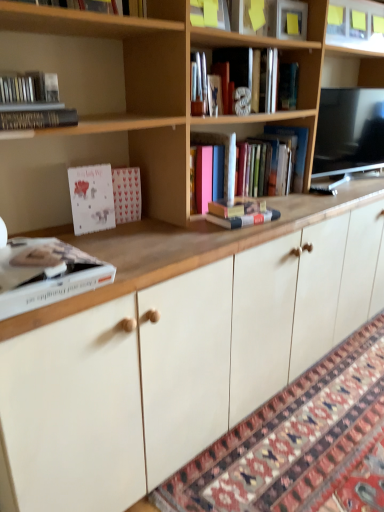
What is the approximate width of matte black bookshelf at upper left, the seventh book positioned from the right?

4.85 inches.

Image resolution: width=384 pixels, height=512 pixels. What are the coordinates of `matte black bookshelf at upper left, marked as the first book in a left-to-right arrangement` in the screenshot? It's located at (33, 102).

Identify the location of metallic silver letter at upper center, the second book in the right-to-left sequence. (273, 82).

The height and width of the screenshot is (512, 384). What do you see at coordinates (293, 438) in the screenshot? I see `patterned carpet at lower right` at bounding box center [293, 438].

What do you see at coordinates (225, 156) in the screenshot? This screenshot has width=384, height=512. I see `hardcover book at center, acting as the fourth book starting from the right` at bounding box center [225, 156].

This screenshot has width=384, height=512. What do you see at coordinates (47, 275) in the screenshot?
I see `white matte book at lower left, which is the third book from left to right` at bounding box center [47, 275].

You are a GUI agent. You are given a task and a screenshot of the screen. Output one action in this format:
    pyautogui.click(x=<x>, y=<y>)
    Task: Click on the matte black bookshelf at upper left, marked as the first book in a left-to-right arrangement
    The image size is (384, 512).
    Given the screenshot: What is the action you would take?
    pyautogui.click(x=33, y=102)

Can you confirm if hardcover book at center, which is the 4th book from left to right, is thinner than wooden bookcase at upper center?

Correct, the width of hardcover book at center, which is the 4th book from left to right, is less than that of wooden bookcase at upper center.

In terms of size, does hardcover book at center, which is the 4th book from left to right, appear bigger or smaller than wooden bookcase at upper center?

In the image, hardcover book at center, which is the 4th book from left to right, appears to be smaller than wooden bookcase at upper center.

Measure the distance from hardcover book at center, which is the 4th book from left to right, to wooden bookcase at upper center.

hardcover book at center, which is the 4th book from left to right, is 39.29 centimeters away from wooden bookcase at upper center.

Considering the sizes of hardcover book at center, acting as the fourth book starting from the right, and wooden bookcase at upper center in the image, is hardcover book at center, acting as the fourth book starting from the right, taller or shorter than wooden bookcase at upper center?

Considering their sizes, hardcover book at center, acting as the fourth book starting from the right, has less height than wooden bookcase at upper center.

Is hardcover book at center, acting as the fourth book starting from the right, positioned before patterned carpet at lower right?

No, hardcover book at center, acting as the fourth book starting from the right, is behind patterned carpet at lower right.

Could you tell me if hardcover book at center, acting as the fourth book starting from the right, is turned towards patterned carpet at lower right?

No, hardcover book at center, acting as the fourth book starting from the right, is not turned towards patterned carpet at lower right.

From a real-world perspective, is hardcover book at center, acting as the fourth book starting from the right, above or below patterned carpet at lower right?

Clearly, from a real-world perspective, hardcover book at center, acting as the fourth book starting from the right, is above patterned carpet at lower right.

Identify the location of mat below the hardcover book at center, acting as the fourth book starting from the right (from a real-world perspective). This screenshot has width=384, height=512. (293, 438).

Looking at this image, between hardcover book at center, which is the third book from right to left, and wooden bookcase at upper center, which one has smaller size?

hardcover book at center, which is the third book from right to left, is smaller.

Based on the photo, is hardcover book at center, the 5th book positioned from the left, next to wooden bookcase at upper center and touching it?

No, hardcover book at center, the 5th book positioned from the left, is not beside wooden bookcase at upper center.

Would you say wooden bookcase at upper center is part of hardcover book at center, which is the third book from right to left,'s contents?

No, wooden bookcase at upper center is not surrounded by hardcover book at center, which is the third book from right to left.

From the image's perspective, which one is positioned lower, hardcover book at center, the 5th book positioned from the left, or wooden bookcase at upper center?

hardcover book at center, the 5th book positioned from the left, is shown below in the image.

Can you tell me how much matte black bookshelf at upper left, the seventh book positioned from the right, and white matte book at lower left, which is the third book from left to right, differ in facing direction?

The angle between the facing direction of matte black bookshelf at upper left, the seventh book positioned from the right, and the facing direction of white matte book at lower left, which is the third book from left to right, is 0.00277 degrees.

Can you confirm if matte black bookshelf at upper left, the seventh book positioned from the right, is thinner than white matte book at lower left, which is the third book from left to right?

Correct, the width of matte black bookshelf at upper left, the seventh book positioned from the right, is less than that of white matte book at lower left, which is the third book from left to right.

Considering the positions of objects matte black bookshelf at upper left, the seventh book positioned from the right, and white matte book at lower left, acting as the 5th book starting from the right, in the image provided, who is more to the left, matte black bookshelf at upper left, the seventh book positioned from the right, or white matte book at lower left, acting as the 5th book starting from the right,?

matte black bookshelf at upper left, the seventh book positioned from the right.

Considering the positions of points (233, 190) and (222, 199), is point (233, 190) closer to camera compared to point (222, 199)?

No, it is not.

Is hardcover book at center, which is the 4th book from left to right, bigger or smaller than hardcover book at center, which is the third book from right to left?

Considering their sizes, hardcover book at center, which is the 4th book from left to right, takes up more space than hardcover book at center, which is the third book from right to left.

Considering the sizes of hardcover book at center, acting as the fourth book starting from the right, and hardcover book at center, the 5th book positioned from the left, in the image, is hardcover book at center, acting as the fourth book starting from the right, taller or shorter than hardcover book at center, the 5th book positioned from the left,?

Considering their sizes, hardcover book at center, acting as the fourth book starting from the right, has more height than hardcover book at center, the 5th book positioned from the left.

From the image's perspective, is hardcover book at center, which is the 4th book from left to right, beneath hardcover book at center, which is the third book from right to left?

No.

From a real-world perspective, starting from the hardcover book at center, which is the 7th book in left-to-right order, which book is the 2nd one vertically above it? Please provide its 2D coordinates.

[(33, 102)]

How different are the orientations of hardcover book at center, which is the 7th book in left-to-right order, and matte black bookshelf at upper left, the seventh book positioned from the right, in degrees?

There is a 4.57-degree angle between the facing directions of hardcover book at center, which is the 7th book in left-to-right order, and matte black bookshelf at upper left, the seventh book positioned from the right.

From the picture: Does hardcover book at center, which is the 7th book in left-to-right order, have a smaller size compared to matte black bookshelf at upper left, the seventh book positioned from the right?

No.

Is point (279, 132) positioned after point (66, 109)?

Yes, it is behind point (66, 109).

Is hardcover book at center, which is the 7th book in left-to-right order, completely or partially outside of hardcover book at upper left, the sixth book when ordered from right to left?

Indeed, hardcover book at center, which is the 7th book in left-to-right order, is completely outside hardcover book at upper left, the sixth book when ordered from right to left.

Does hardcover book at center, which is the first book in right-to-left order, have a greater width compared to hardcover book at upper left, which ranks as the 2th book in left-to-right order?

No, hardcover book at center, which is the first book in right-to-left order, is not wider than hardcover book at upper left, which ranks as the 2th book in left-to-right order.

Is hardcover book at center, which is the 7th book in left-to-right order, oriented towards hardcover book at upper left, the sixth book when ordered from right to left?

No, hardcover book at center, which is the 7th book in left-to-right order, is not oriented towards hardcover book at upper left, the sixth book when ordered from right to left.

Which object is closer to the camera, hardcover book at center, which is the first book in right-to-left order, or hardcover book at upper left, the sixth book when ordered from right to left?

hardcover book at upper left, the sixth book when ordered from right to left, is more forward.

From the wooden bookcase at upper center, count 6th books backward and point to it. Please provide its 2D coordinates.

[(225, 156)]

Find the location of a particular element. Image resolution: width=384 pixels, height=512 pixels. mat in front of the hardcover book at center, acting as the fourth book starting from the right is located at coordinates (293, 438).

Considering their positions, is hardcover book at center, acting as the fourth book starting from the right, positioned further to black glossy tv at upper right than white glossy shelf at upper center?

hardcover book at center, acting as the fourth book starting from the right.

Looking at the image, which one is located further to hardcover book at center, which is the 4th book from left to right, wooden bookcase at upper center or white matte book at lower left, which is the third book from left to right?

white matte book at lower left, which is the third book from left to right, is further to hardcover book at center, which is the 4th book from left to right.

Estimate the real-world distances between objects in this image. Which object is further from hardcover book at upper left, the sixth book when ordered from right to left, metallic silver letter at upper center, the second book in the right-to-left sequence, or wooden bookcase at upper center?

metallic silver letter at upper center, the second book in the right-to-left sequence.

Based on their spatial positions, is hardcover book at center, acting as the fourth book starting from the right, or patterned carpet at lower right closer to metallic silver letter at upper center, the 6th book from the left?

hardcover book at center, acting as the fourth book starting from the right, lies closer to metallic silver letter at upper center, the 6th book from the left, than the other object.

Based on their spatial positions, is white matte book at lower left, which is the third book from left to right, or wooden bookcase at upper center further from patterned carpet at lower right?

wooden bookcase at upper center.

Estimate the real-world distances between objects in this image. Which object is further from patterned carpet at lower right, white glossy shelf at upper center or metallic silver letter at upper center, the second book in the right-to-left sequence?

The object further to patterned carpet at lower right is white glossy shelf at upper center.

Based on the photo, which object lies further to the anchor point black glossy tv at upper right, wooden bookcase at upper center or metallic silver letter at upper center, the second book in the right-to-left sequence?

wooden bookcase at upper center lies further to black glossy tv at upper right than the other object.

Considering their positions, is white glossy shelf at upper center positioned further to matte black bookshelf at upper left, the seventh book positioned from the right, than white matte book at lower left, which is the third book from left to right?

white glossy shelf at upper center is further to matte black bookshelf at upper left, the seventh book positioned from the right.

The height and width of the screenshot is (512, 384). Find the location of `television between white glossy shelf at upper center and hardcover book at center, which is the 7th book in left-to-right order, vertically`. television between white glossy shelf at upper center and hardcover book at center, which is the 7th book in left-to-right order, vertically is located at coordinates (349, 131).

Identify the location of shelf between metallic silver letter at upper center, the second book in the right-to-left sequence, and black glossy tv at upper right, in the horizontal direction. click(x=356, y=25).

The width and height of the screenshot is (384, 512). I want to click on shelf between white matte book at lower left, acting as the 5th book starting from the right, and black glossy tv at upper right, so click(x=356, y=25).

Find the location of a particular element. This screenshot has width=384, height=512. shelf between hardcover book at center, acting as the fourth book starting from the right, and black glossy tv at upper right, in the horizontal direction is located at coordinates (356, 25).